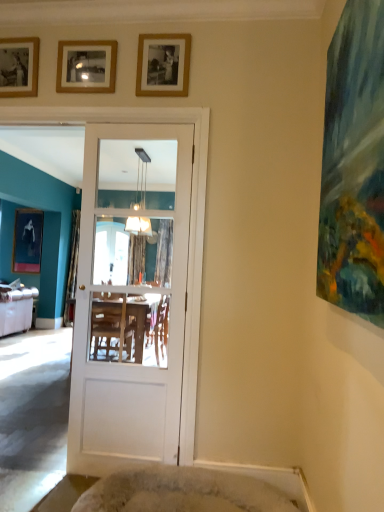
Question: Considering the positions of wooden photo frame at upper left, which is the second picture frame in left-to-right order, and wooden picture frame at upper center, the third picture frame when ordered from left to right, in the image, is wooden photo frame at upper left, which is the second picture frame in left-to-right order, bigger or smaller than wooden picture frame at upper center, the third picture frame when ordered from left to right,?

Choices:
 (A) small
 (B) big

Answer: (B)

Question: In terms of height, does wooden photo frame at upper left, the 3th picture frame from the front, look taller or shorter compared to wooden picture frame at upper center, acting as the third picture frame starting from the back?

Choices:
 (A) short
 (B) tall

Answer: (B)

Question: Which is nearer to the gold-framed photo at upper center, arranged as the 1th picture frame when viewed from the right?

Choices:
 (A) white glossy door at center
 (B) wooden photo frame at upper left, which is the second picture frame in left-to-right order
 (C) beige plush cat bed at lower center
 (D) silver metallic studio couch at left
 (E) matte black portrait at left, the 1th picture frame in the left-to-right sequence

Answer: (B)

Question: Estimate the real-world distances between objects in this image. Which object is closer to the matte black portrait at left, the 1th picture frame in the left-to-right sequence?

Choices:
 (A) gold-framed photo at upper center, the fourth picture frame when ordered from left to right
 (B) beige plush cat bed at lower center
 (C) wooden picture frame at upper center, the second picture frame in the front-to-back sequence
 (D) wooden photo frame at upper left, arranged as the third picture frame when viewed from the right
 (E) silver metallic studio couch at left

Answer: (E)